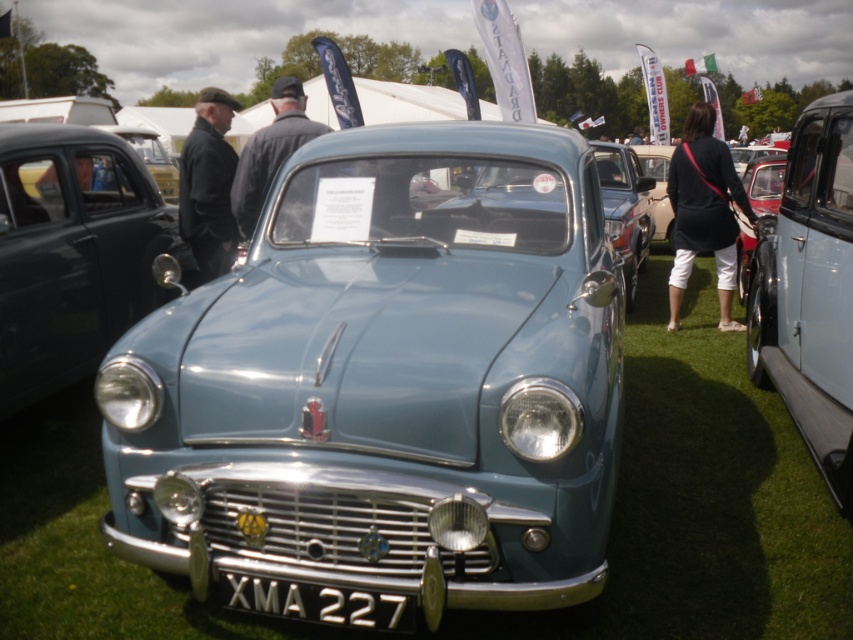
Question: Considering the relative positions of light blue metallic car at center and dark blue jacket at upper center in the image provided, where is light blue metallic car at center located with respect to dark blue jacket at upper center?

Choices:
 (A) left
 (B) right

Answer: (B)

Question: Among these points, which one is nearest to the camera?

Choices:
 (A) (653, 192)
 (B) (695, 154)

Answer: (B)

Question: Which of the following is the closest to the observer?

Choices:
 (A) (341, 611)
 (B) (683, 129)
 (C) (601, 140)
 (D) (817, 308)

Answer: (A)

Question: Is dark blue fabric dress at center closer to camera compared to light blue metallic car at center?

Choices:
 (A) no
 (B) yes

Answer: (A)

Question: Which point is closer to the camera?

Choices:
 (A) (827, 326)
 (B) (260, 611)
 (C) (256, 140)

Answer: (B)

Question: Is matte blue car at center behind dark gray fabric jacket at upper left?

Choices:
 (A) no
 (B) yes

Answer: (A)